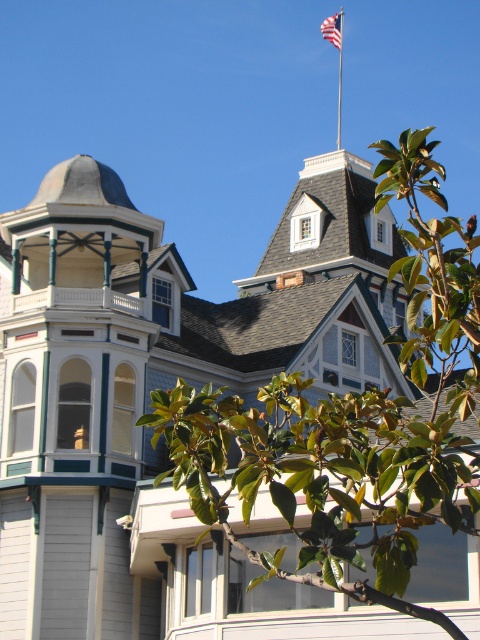
Question: Estimate the real-world distances between objects in this image. Which object is farther from the metallic flag pole at upper center?

Choices:
 (A) green leafy tree at upper center
 (B) american flag at upper center

Answer: (A)

Question: Can you confirm if metallic flag pole at upper center is thinner than american flag at upper center?

Choices:
 (A) yes
 (B) no

Answer: (A)

Question: Which is nearer to the green leafy tree at upper center?

Choices:
 (A) american flag at upper center
 (B) metallic flag pole at upper center

Answer: (B)

Question: Is green leafy tree at upper center above metallic flag pole at upper center?

Choices:
 (A) no
 (B) yes

Answer: (A)

Question: Can you confirm if green leafy tree at upper center is positioned above metallic flag pole at upper center?

Choices:
 (A) yes
 (B) no

Answer: (B)

Question: Which of the following is the farthest from the observer?

Choices:
 (A) american flag at upper center
 (B) metallic flag pole at upper center

Answer: (A)